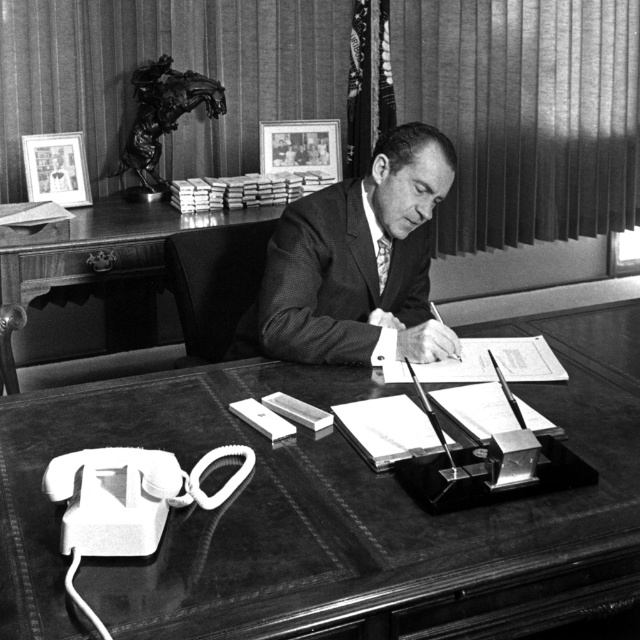
Question: Can you confirm if smooth suit at center is smaller than wooden desk at center?

Choices:
 (A) no
 (B) yes

Answer: (B)

Question: Which point is farther from the camera taking this photo?

Choices:
 (A) (356, 384)
 (B) (42, 228)
 (C) (435, 337)

Answer: (B)

Question: Where is leather at center located in relation to smooth suit at center in the image?

Choices:
 (A) left
 (B) right

Answer: (B)

Question: Which point appears closest to the camera in this image?

Choices:
 (A) (173, 588)
 (B) (360, 227)

Answer: (A)

Question: Among these objects, which one is farthest from the camera?

Choices:
 (A) wooden desk at center
 (B) leather at center
 (C) smooth suit at center

Answer: (A)

Question: Can you confirm if leather at center is bigger than wooden desk at center?

Choices:
 (A) yes
 (B) no

Answer: (A)